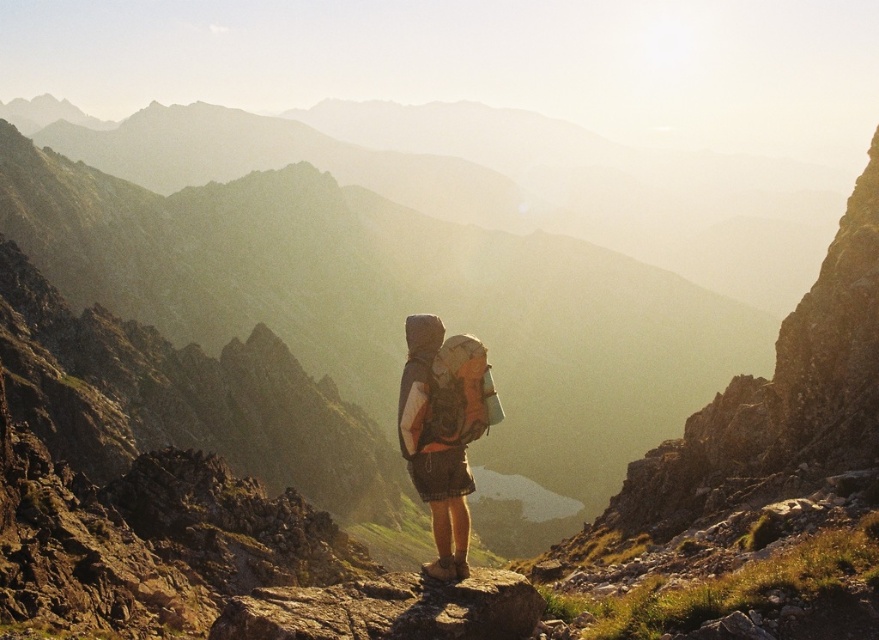
Which is below, rusty rock at center or matte gray backpack at center?

rusty rock at center is below.

Is point (256, 600) less distant than point (442, 376)?

Yes, point (256, 600) is closer to viewer.

Where is `rusty rock at center`? rusty rock at center is located at coordinates (387, 609).